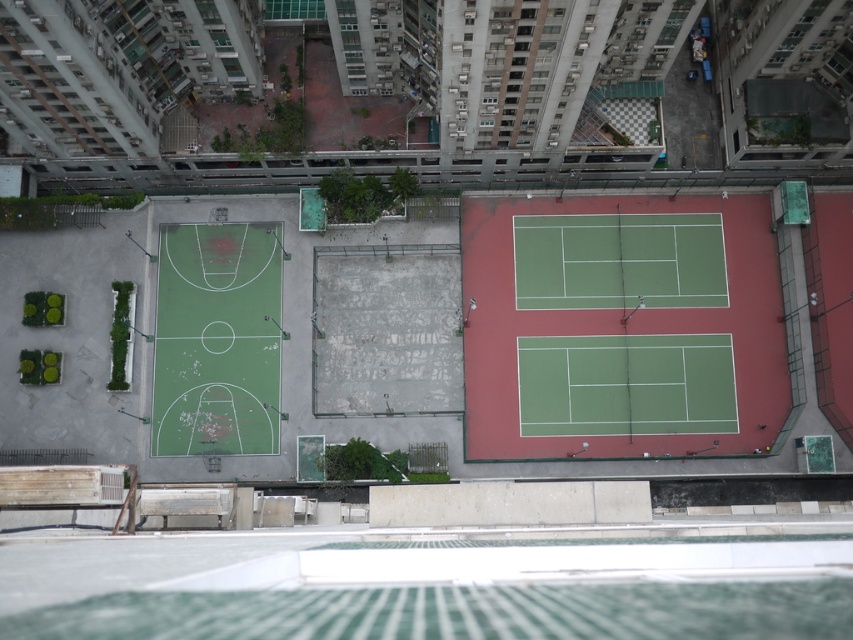
You are a drone operator trying to deliver a package to a specific location on the rooftop sports complex. The coordinates given are point (618, 260). Based on the scene description, which court is this point located on?

The point (618, 260) is on the green rubber basketball court at center.

You are a drone operator trying to capture a photo of the green rubber basketball court at center and the matte green tennis racket at center. Since the drone has a limited field of view, you need to ensure both objects are fully visible. Given their sizes, which object requires more space in the frame?

The green rubber basketball court at center is bigger than the matte green tennis racket at center, so it requires more space in the frame to be fully visible.